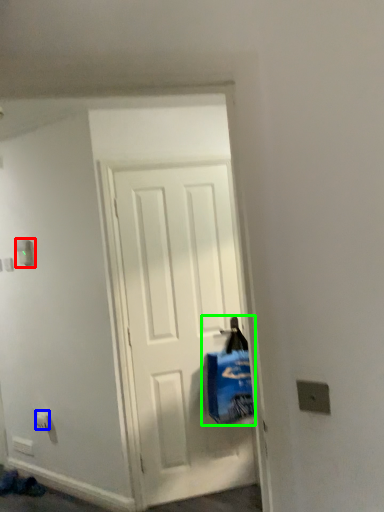
Question: Which object is the farthest from light switch (highlighted by a red box)? Choose among these: electric outlet (highlighted by a blue box) or shopping bag (highlighted by a green box).

Choices:
 (A) electric outlet
 (B) shopping bag

Answer: (B)